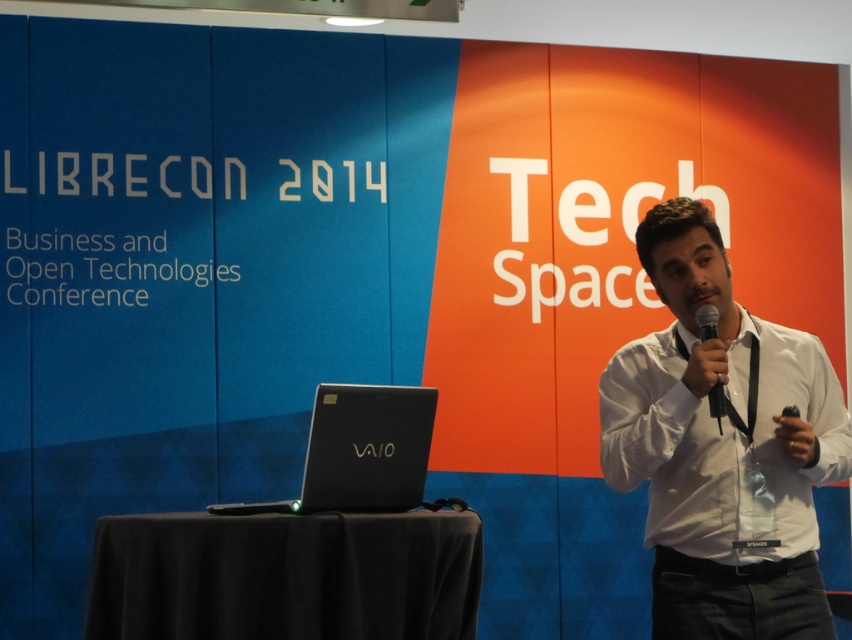
Question: Among these points, which one is farthest from the camera?

Choices:
 (A) (613, 396)
 (B) (705, 324)
 (C) (419, 403)

Answer: (C)

Question: Is white shirt at center behind black matte vaio at lower left?

Choices:
 (A) yes
 (B) no

Answer: (B)

Question: Which object is closer to the camera taking this photo?

Choices:
 (A) white shirt at center
 (B) black metallic microphone at center
 (C) black matte vaio at lower left

Answer: (A)

Question: Can you confirm if black matte vaio at lower left is positioned above black metallic microphone at center?

Choices:
 (A) no
 (B) yes

Answer: (A)

Question: Where is white shirt at center located in relation to black matte vaio at lower left in the image?

Choices:
 (A) above
 (B) below

Answer: (A)

Question: Which point is closer to the camera?

Choices:
 (A) black matte vaio at lower left
 (B) white shirt at center

Answer: (B)